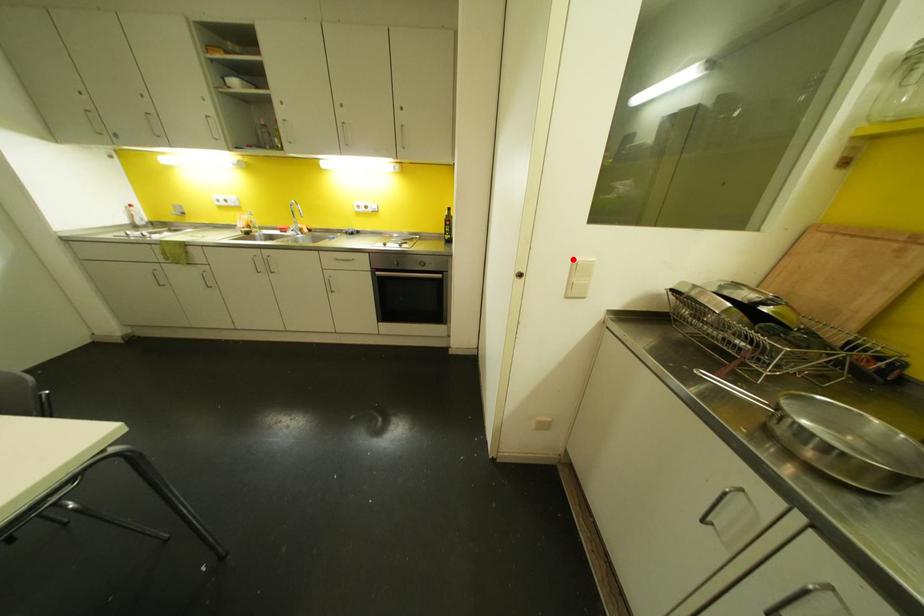
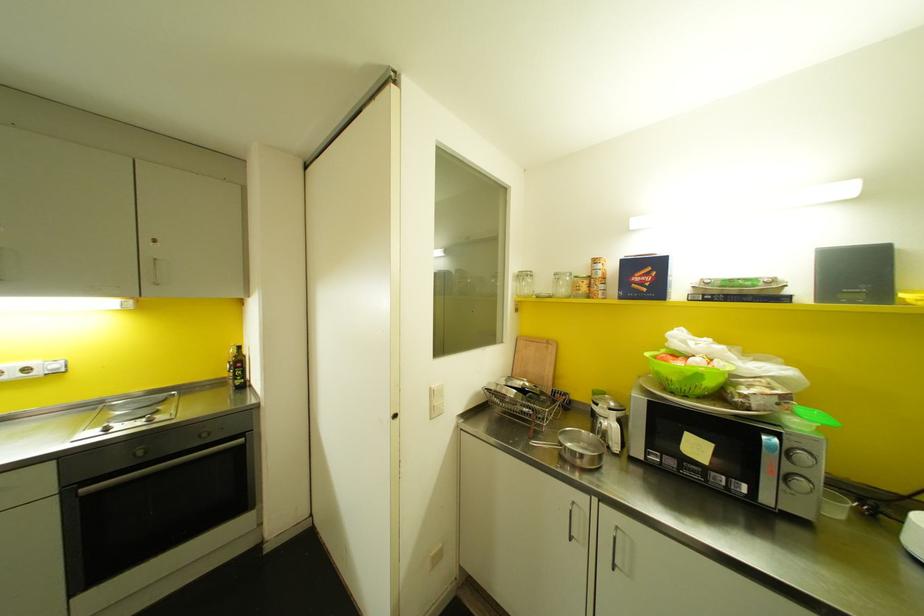
Where in the second image is the point corresponding to the highlighted location from the first image?

(430, 387)